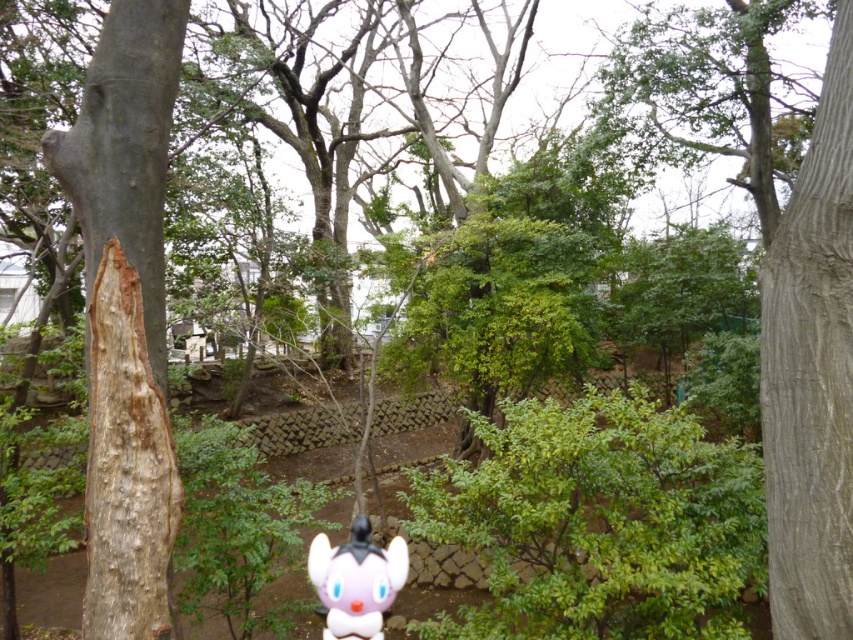
Is gray textured tree trunk at right to the right of light brown rough bark at left from the viewer's perspective?

Correct, you'll find gray textured tree trunk at right to the right of light brown rough bark at left.

Can you confirm if gray textured tree trunk at right is shorter than light brown rough bark at left?

No, gray textured tree trunk at right is not shorter than light brown rough bark at left.

You are a GUI agent. You are given a task and a screenshot of the screen. Output one action in this format:
    pyautogui.click(x=<x>, y=<y>)
    Task: Click on the gray textured tree trunk at right
    The image size is (853, 640).
    Given the screenshot: What is the action you would take?
    pyautogui.click(x=811, y=371)

The height and width of the screenshot is (640, 853). Find the location of `gray textured tree trunk at right`. gray textured tree trunk at right is located at coordinates (811, 371).

Can you confirm if gray textured tree trunk at right is positioned below white glossy plush toy at center?

No, gray textured tree trunk at right is not below white glossy plush toy at center.

In the scene shown: Does gray textured tree trunk at right have a greater height compared to white glossy plush toy at center?

Correct, gray textured tree trunk at right is much taller as white glossy plush toy at center.

Between point (769, 374) and point (340, 611), which one is positioned in front?

Point (769, 374)

Locate an element on the screen. gray textured tree trunk at right is located at coordinates (811, 371).

How distant is light brown rough bark at left from white glossy plush toy at center?

The distance of light brown rough bark at left from white glossy plush toy at center is 2.16 meters.

Between point (111, 609) and point (381, 580), which one is positioned in front?

Point (111, 609) is more forward.

The height and width of the screenshot is (640, 853). I want to click on light brown rough bark at left, so click(x=126, y=467).